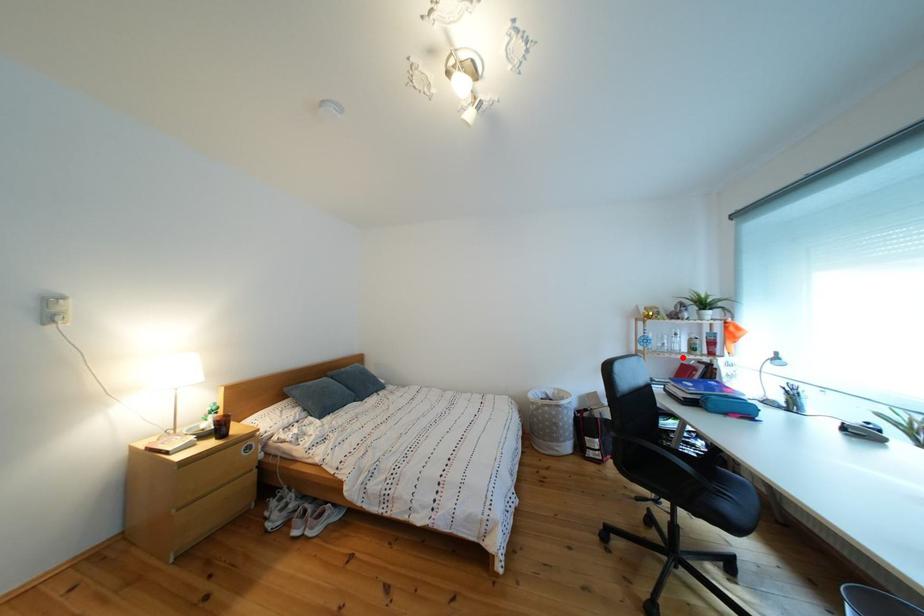
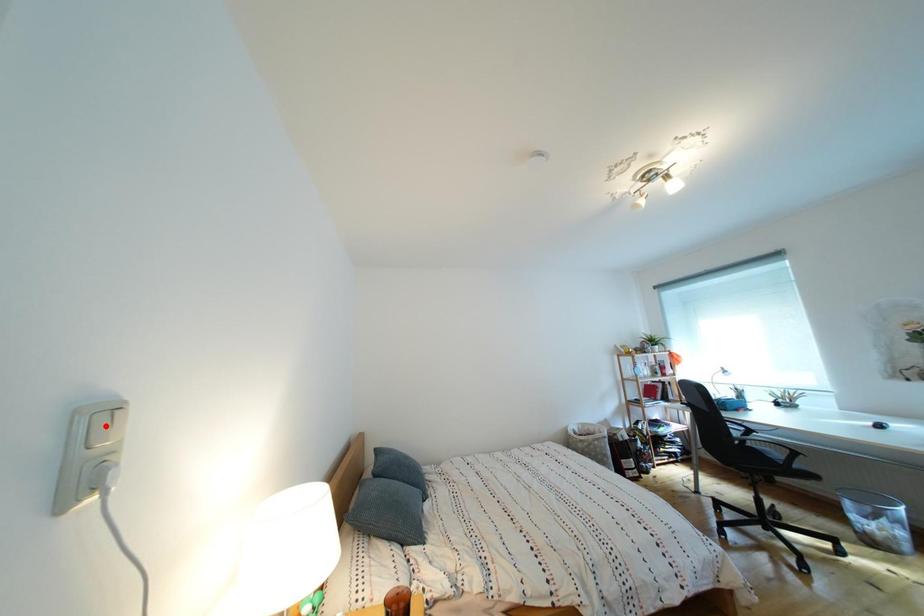
I am providing you with two images of the same scene from different viewpoints. A red point is marked on the first image and another point is marked on the second image. Is the red point in image1 aligned with the point shown in image2?

No